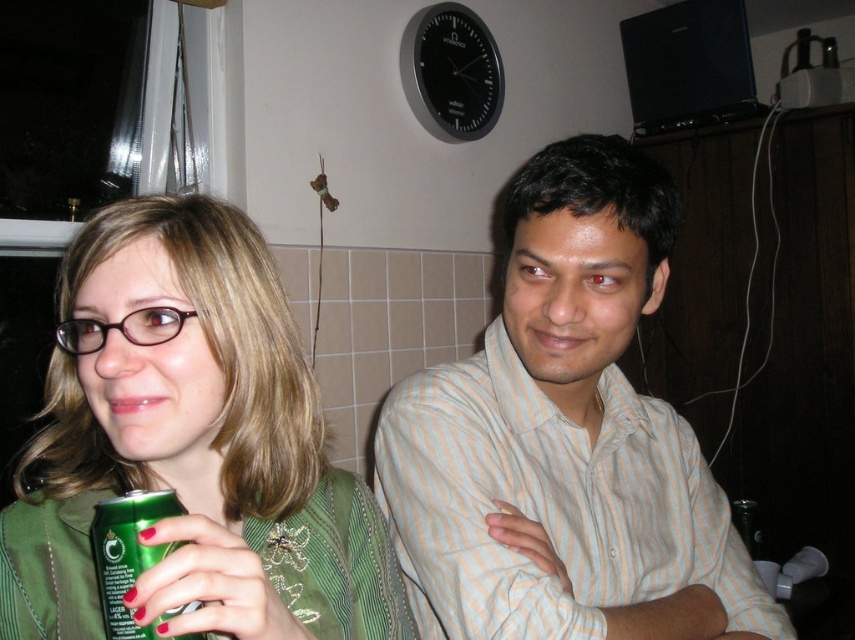
Looking at this image, can you confirm if light beige striped shirt at center is positioned to the left of green metallic can at lower left?

In fact, light beige striped shirt at center is to the right of green metallic can at lower left.

Can you confirm if light beige striped shirt at center is shorter than green metallic can at lower left?

No, light beige striped shirt at center is not shorter than green metallic can at lower left.

Identify the location of light beige striped shirt at center. (565, 436).

Describe the element at coordinates (565, 436) in the screenshot. I see `light beige striped shirt at center` at that location.

Is point (511, 317) more distant than point (289, 577)?

Yes, it is.

Is point (449, 502) in front of point (181, 307)?

No, it is not.

At what (x,y) coordinates should I click in order to perform the action: click on light beige striped shirt at center. Please return your answer as a coordinate pair (x, y). The image size is (855, 640). Looking at the image, I should click on coord(565,436).

Is point (78, 324) closer to viewer compared to point (118, 579)?

No.

Does green matte can at left have a lesser width compared to green metallic can at lower left?

In fact, green matte can at left might be wider than green metallic can at lower left.

Find the location of a particular element. green matte can at left is located at coordinates (192, 445).